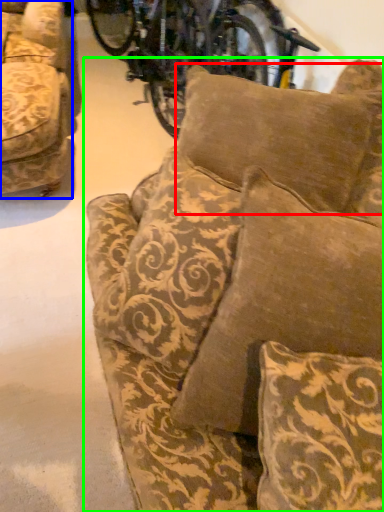
Question: Which object is positioned closest to pillow (highlighted by a red box)? Select from studio couch (highlighted by a blue box) and studio couch (highlighted by a green box).

Choices:
 (A) studio couch
 (B) studio couch

Answer: (B)